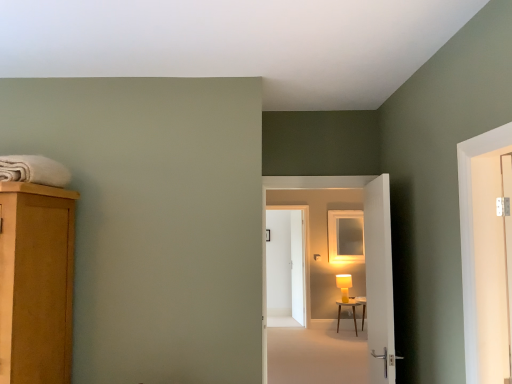
Question: From the image's perspective, is white soft towel at upper left below wooden side table at center?

Choices:
 (A) no
 (B) yes

Answer: (A)

Question: Does white soft towel at upper left have a greater height compared to wooden side table at center?

Choices:
 (A) yes
 (B) no

Answer: (B)

Question: From a real-world perspective, is white soft towel at upper left positioned under wooden side table at center based on gravity?

Choices:
 (A) no
 (B) yes

Answer: (A)

Question: Is white soft towel at upper left turned away from wooden side table at center?

Choices:
 (A) no
 (B) yes

Answer: (A)

Question: Can you confirm if white soft towel at upper left is bigger than wooden side table at center?

Choices:
 (A) no
 (B) yes

Answer: (A)

Question: Is white glossy door at center, marked as the 2th door in a back-to-front arrangement, bigger or smaller than yellow matte table lamp at center?

Choices:
 (A) small
 (B) big

Answer: (B)

Question: From the image's perspective, relative to yellow matte table lamp at center, is white glossy door at center, marked as the 2th door in a back-to-front arrangement, above or below?

Choices:
 (A) above
 (B) below

Answer: (A)

Question: Is white glossy door at center, the 2th door from the front, in front of or behind yellow matte table lamp at center in the image?

Choices:
 (A) behind
 (B) front

Answer: (B)

Question: In terms of width, does white glossy door at center, marked as the 2th door in a back-to-front arrangement, look wider or thinner when compared to yellow matte table lamp at center?

Choices:
 (A) wide
 (B) thin

Answer: (B)

Question: Is wooden side table at center to the left or to the right of white glossy screen door at right, which ranks as the first screen door in right-to-left order, in the image?

Choices:
 (A) left
 (B) right

Answer: (B)

Question: From a real-world perspective, is wooden side table at center positioned above or below white glossy screen door at right, which is the 1th screen door from front to back?

Choices:
 (A) above
 (B) below

Answer: (B)

Question: Is point (339, 317) positioned closer to the camera than point (478, 206)?

Choices:
 (A) closer
 (B) farther

Answer: (B)

Question: Considering their positions, is wooden side table at center located in front of or behind white glossy screen door at right, which is the 1th screen door from front to back?

Choices:
 (A) front
 (B) behind

Answer: (B)

Question: Based on their sizes in the image, would you say wooden side table at center is bigger or smaller than matte white medicine cabinet at center?

Choices:
 (A) big
 (B) small

Answer: (A)

Question: In terms of width, does wooden side table at center look wider or thinner when compared to matte white medicine cabinet at center?

Choices:
 (A) wide
 (B) thin

Answer: (A)